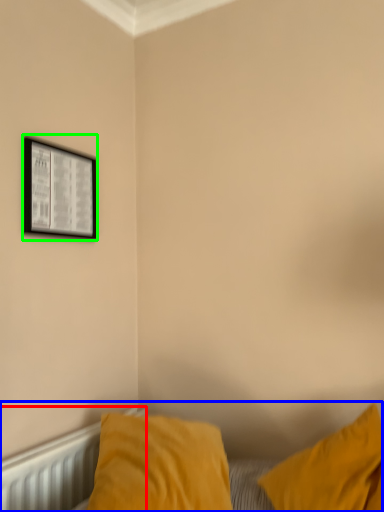
Question: Based on their relative distances, which object is farther from radiator (highlighted by a red box)? Choose from bed (highlighted by a blue box) and picture frame (highlighted by a green box).

Choices:
 (A) bed
 (B) picture frame

Answer: (B)